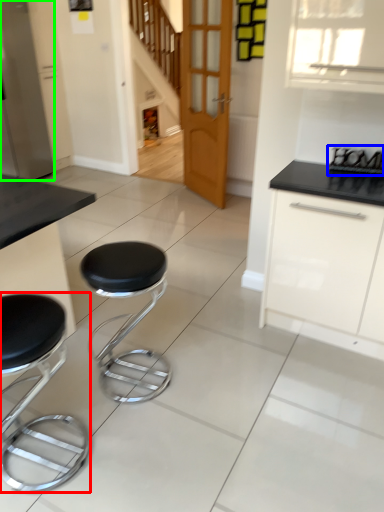
Question: Which object is the closest to the stool (highlighted by a red box)? Choose among these: appliance (highlighted by a blue box) or appliance (highlighted by a green box).

Choices:
 (A) appliance
 (B) appliance

Answer: (A)